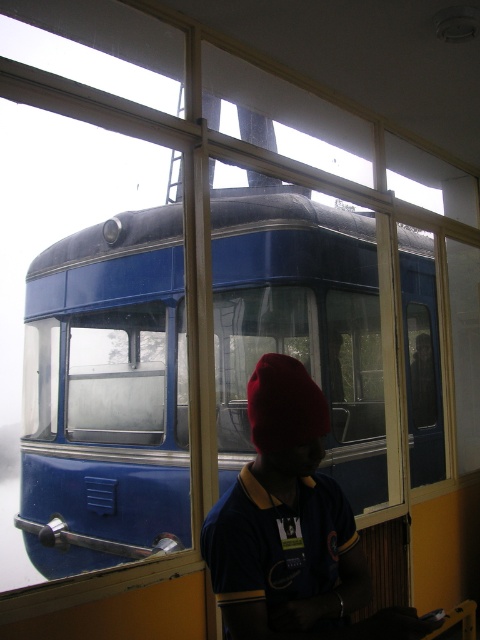
Which is behind, point (130, 451) or point (305, 632)?

Point (130, 451)

Looking at this image, which is more to the right, blue metallic tram at center or matte red beanie at center?

matte red beanie at center

Between point (225, 356) and point (232, 570), which one is positioned behind?

Positioned behind is point (225, 356).

At what (x,y) coordinates should I click in order to perform the action: click on blue metallic tram at center. Please return your answer as a coordinate pair (x, y). This screenshot has width=480, height=640. Looking at the image, I should click on (106, 394).